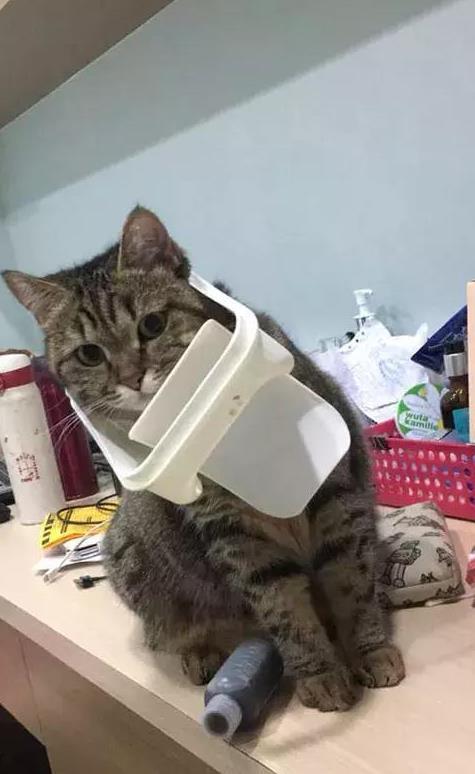
Find where you'd dispense the soap in the image. Your answer should be formatted as a list of tuples, i.e. [(x1, y1), (x2, y2), ...], where each tuple contains the x and y coordinates of a point satisfying the conditions above.

[(363, 300)]